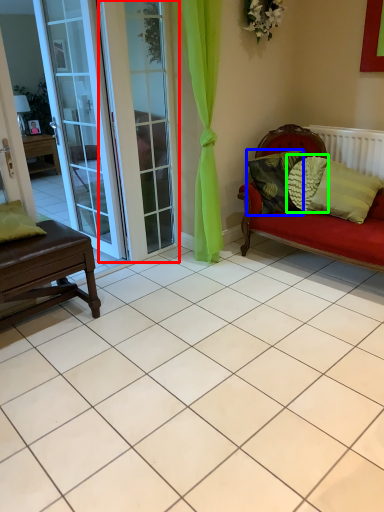
Question: Estimate the real-world distances between objects in this image. Which object is farther from screen door (highlighted by a red box), pillow (highlighted by a blue box) or pillow (highlighted by a green box)?

Choices:
 (A) pillow
 (B) pillow

Answer: (B)